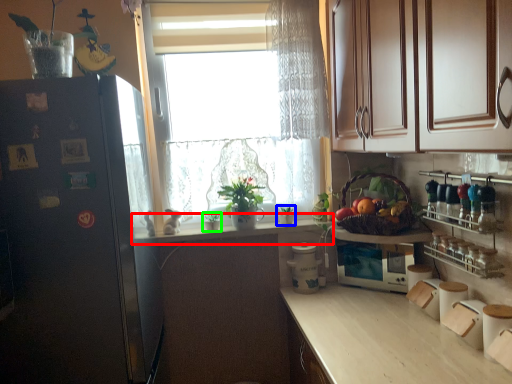
Question: Which object is positioned farthest from countertop (highlighted by a red box)? Select from houseplant (highlighted by a blue box) and houseplant (highlighted by a green box).

Choices:
 (A) houseplant
 (B) houseplant

Answer: (A)